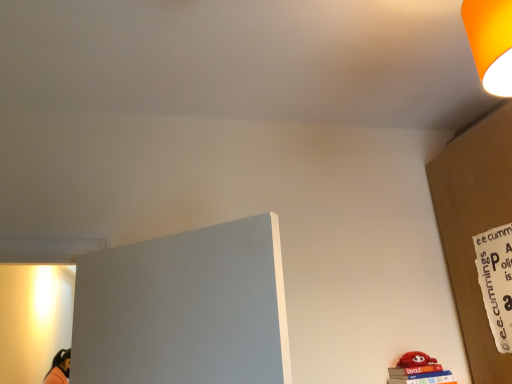
I want to click on orange matte lampshade at upper right, so click(490, 42).

What is the approximate height of orange matte lampshade at upper right?

The height of orange matte lampshade at upper right is 11.49 inches.

What do you see at coordinates (490, 42) in the screenshot? The image size is (512, 384). I see `orange matte lampshade at upper right` at bounding box center [490, 42].

Locate an element on the screen. The image size is (512, 384). white paper sign at right is located at coordinates (496, 281).

What do you see at coordinates (496, 281) in the screenshot? I see `white paper sign at right` at bounding box center [496, 281].

In order to face white paper sign at right, should I rotate leftwards or rightwards?

Turn right approximately 31.116 degrees to face it.

Find the location of a particular element. orange matte lampshade at upper right is located at coordinates (490, 42).

Does white paper sign at right appear on the right side of orange matte lampshade at upper right?

Correct, you'll find white paper sign at right to the right of orange matte lampshade at upper right.

Between white paper sign at right and orange matte lampshade at upper right, which one is positioned behind?

Positioned behind is white paper sign at right.

Is point (507, 347) closer to viewer compared to point (483, 68)?

No, it is behind (483, 68).

In the scene shown: From the image's perspective, relative to orange matte lampshade at upper right, is white paper sign at right above or below?

From the image's perspective, white paper sign at right appears below orange matte lampshade at upper right.

From a real-world perspective, which is physically above, white paper sign at right or orange matte lampshade at upper right?

orange matte lampshade at upper right, from a real-world perspective.

Can you confirm if white paper sign at right is thinner than orange matte lampshade at upper right?

Yes.

Between white paper sign at right and orange matte lampshade at upper right, which one has less height?

orange matte lampshade at upper right is shorter.

Which of these two, white paper sign at right or orange matte lampshade at upper right, is bigger?

Bigger between the two is orange matte lampshade at upper right.

Is orange matte lampshade at upper right a part of white paper sign at right?

That's incorrect, orange matte lampshade at upper right is not inside white paper sign at right.

Are white paper sign at right and orange matte lampshade at upper right making contact?

No, white paper sign at right is not with orange matte lampshade at upper right.

Is orange matte lampshade at upper right at the back of white paper sign at right?

white paper sign at right is not turned away from orange matte lampshade at upper right.

Can you tell me how much white paper sign at right and orange matte lampshade at upper right differ in facing direction?

They differ by 0.475 degrees in their facing directions.

At what (x,y) coordinates should I click in order to perform the action: click on warning sign below the orange matte lampshade at upper right (from the image's perspective). Please return your answer as a coordinate pair (x, y). The image size is (512, 384). Looking at the image, I should click on (496, 281).

Based on their positions, is orange matte lampshade at upper right located to the left or right of white paper sign at right?

From the image, it's evident that orange matte lampshade at upper right is to the left of white paper sign at right.

Which is behind, orange matte lampshade at upper right or white paper sign at right?

white paper sign at right.

Is point (510, 64) more distant than point (482, 234)?

No, (510, 64) is closer to viewer.

From the image's perspective, between orange matte lampshade at upper right and white paper sign at right, which one is located above?

orange matte lampshade at upper right, from the image's perspective.

From a real-world perspective, is orange matte lampshade at upper right located higher than white paper sign at right?

Yes.

Is orange matte lampshade at upper right wider than white paper sign at right?

Correct, the width of orange matte lampshade at upper right exceeds that of white paper sign at right.

Which of these two, orange matte lampshade at upper right or white paper sign at right, stands taller?

white paper sign at right.

Does orange matte lampshade at upper right have a larger size compared to white paper sign at right?

Yes.

Is orange matte lampshade at upper right inside or outside of white paper sign at right?

orange matte lampshade at upper right is spatially situated outside white paper sign at right.

Would you say orange matte lampshade at upper right is a long distance from white paper sign at right?

orange matte lampshade at upper right is actually quite close to white paper sign at right.

Is orange matte lampshade at upper right positioned with its back to white paper sign at right?

That's not correct — orange matte lampshade at upper right is not looking away from white paper sign at right.

How different are the orientations of orange matte lampshade at upper right and white paper sign at right in degrees?

They differ by 0.475 degrees in their facing directions.

Locate an element on the screen. This screenshot has height=384, width=512. lamp that appears above the white paper sign at right (from a real-world perspective) is located at coordinates (490, 42).

Image resolution: width=512 pixels, height=384 pixels. Identify the location of lamp that appears above the white paper sign at right (from a real-world perspective). (490, 42).

Find the location of a particular element. warning sign that appears on the right of orange matte lampshade at upper right is located at coordinates (496, 281).